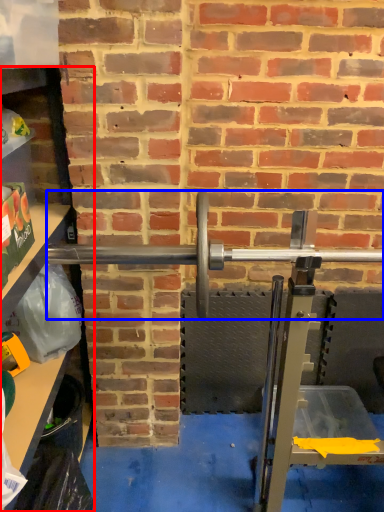
Question: Which object is further to the camera taking this photo, shelf (highlighted by a red box) or barbell (highlighted by a blue box)?

Choices:
 (A) shelf
 (B) barbell

Answer: (B)